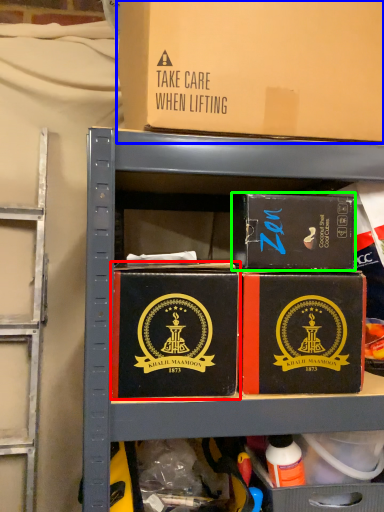
Question: Which is farther away from box (highlighted by a red box)? box (highlighted by a blue box) or box (highlighted by a green box)?

Choices:
 (A) box
 (B) box

Answer: (A)